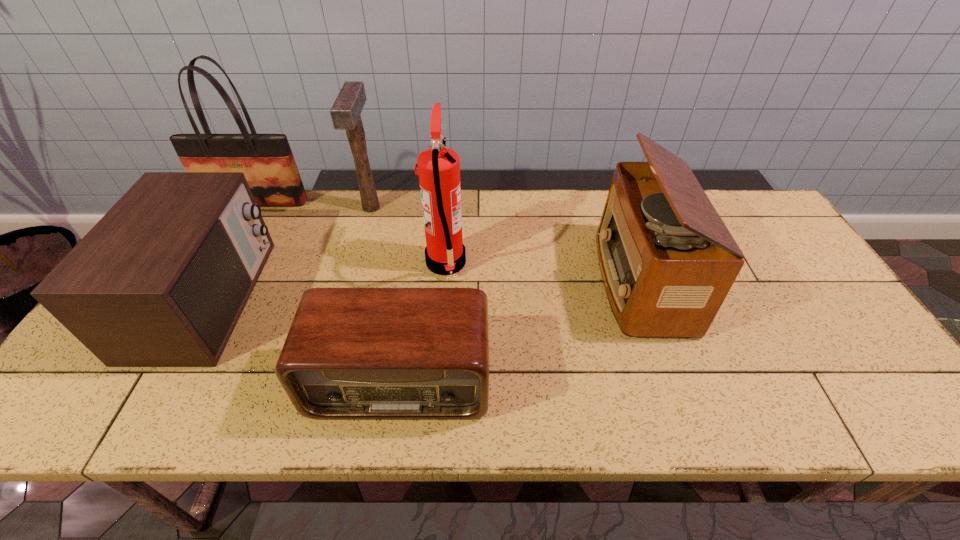
You are a GUI agent. You are given a task and a screenshot of the screen. Output one action in this format:
    pyautogui.click(x=<x>, y=<y>)
    Task: Click on the blank space located with the nozzle aimed from the fire extinguisher
    The image size is (960, 540).
    Given the screenshot: What is the action you would take?
    pyautogui.click(x=593, y=263)

At what (x,y) coordinates should I click in order to perform the action: click on vacant region located 0.310m on the front of the mallet. Please return your answer as a coordinate pair (x, y). Looking at the image, I should click on (345, 301).

At what (x,y) coordinates should I click in order to perform the action: click on vacant space located on the front panel of the rightmost radio receiver. Please return your answer as a coordinate pair (x, y). The height and width of the screenshot is (540, 960). Looking at the image, I should click on (571, 281).

Image resolution: width=960 pixels, height=540 pixels. Identify the location of free space located 0.280m on the front panel of the rightmost radio receiver. (497, 281).

The height and width of the screenshot is (540, 960). What are the coordinates of `vacant region located 0.080m on the front panel of the rightmost radio receiver` in the screenshot? It's located at (571, 281).

The width and height of the screenshot is (960, 540). Identify the location of vacant space located on the front-facing side of the second tallest radio receiver. (283, 299).

At what (x,y) coordinates should I click in order to perform the action: click on shopping bag positioned at the far edge. Please return your answer as a coordinate pair (x, y). Looking at the image, I should click on (266, 160).

Where is `fire extinguisher located at the far edge`? Image resolution: width=960 pixels, height=540 pixels. fire extinguisher located at the far edge is located at coordinates (438, 167).

I want to click on mallet positioned at the far edge, so click(x=345, y=112).

At what (x,y) coordinates should I click in order to perform the action: click on radio receiver that is at the far edge. Please return your answer as a coordinate pair (x, y). The height and width of the screenshot is (540, 960). Looking at the image, I should click on pyautogui.click(x=667, y=261).